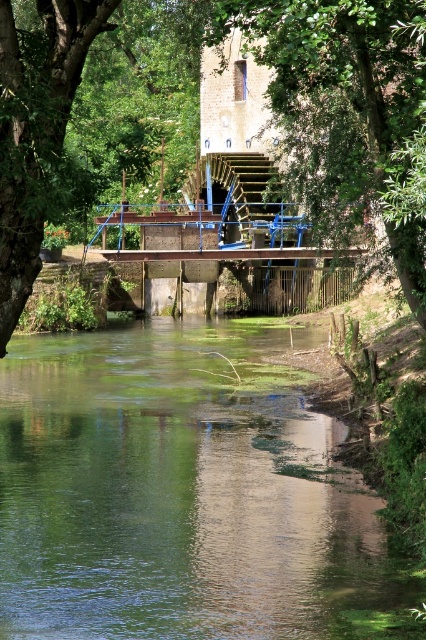
Question: Considering the real-world distances, which object is farthest from the green leafy tree at upper center?

Choices:
 (A) green leafy tree at center
 (B) green reflective water at center

Answer: (B)

Question: Estimate the real-world distances between objects in this image. Which object is closer to the green reflective water at center?

Choices:
 (A) green leafy tree at upper center
 (B) green leafy tree at center

Answer: (B)

Question: Is green reflective water at center to the right of green leafy tree at center from the viewer's perspective?

Choices:
 (A) no
 (B) yes

Answer: (A)

Question: Which point is farther from the camera taking this photo?

Choices:
 (A) pos(279,518)
 (B) pos(259,38)
 (C) pos(374,28)

Answer: (B)

Question: Does green leafy tree at upper center appear over green leafy tree at center?

Choices:
 (A) yes
 (B) no

Answer: (B)

Question: Does green reflective water at center have a smaller size compared to green leafy tree at center?

Choices:
 (A) yes
 (B) no

Answer: (A)